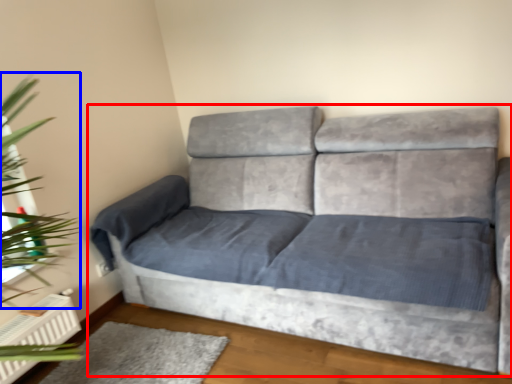
Question: Which object is closer to the camera taking this photo, studio couch (highlighted by a red box) or plant (highlighted by a blue box)?

Choices:
 (A) studio couch
 (B) plant

Answer: (A)